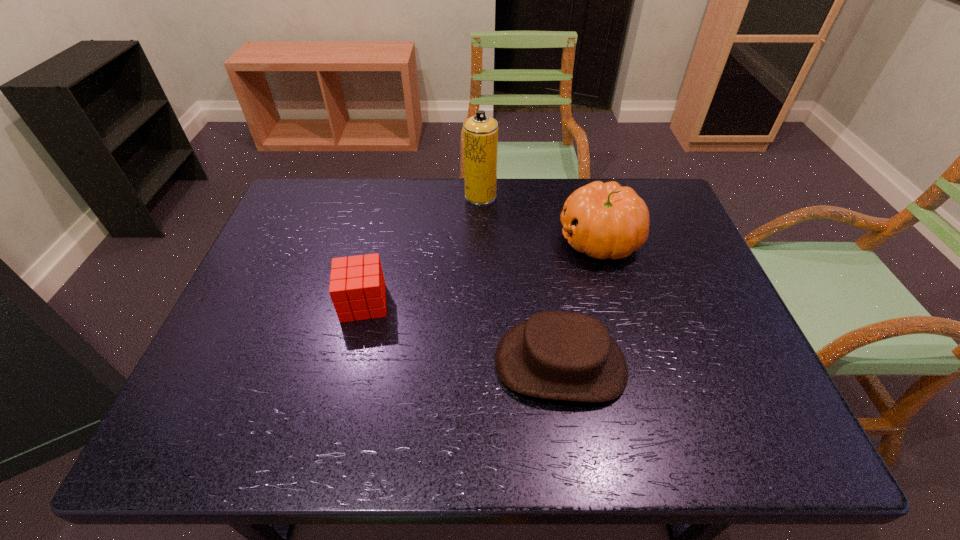
Where is `blank space at the far left corner of the desktop`? The width and height of the screenshot is (960, 540). blank space at the far left corner of the desktop is located at coordinates (326, 201).

Find the location of a particular element. vacant space at the near left corner of the desktop is located at coordinates (205, 413).

Where is `free region at the near right corner of the desktop`? This screenshot has height=540, width=960. free region at the near right corner of the desktop is located at coordinates click(708, 432).

At what (x,y) coordinates should I click in order to perform the action: click on free space between the tallest object and the third shortest object. Please return your answer as a coordinate pair (x, y). Looking at the image, I should click on (540, 218).

I want to click on vacant space in between the leftmost object and the nearest object, so 462,333.

Identify the location of unoccupied position between the second farthest object and the nearest object. The width and height of the screenshot is (960, 540). (580, 301).

The height and width of the screenshot is (540, 960). I want to click on free space that is in between the second tallest object and the farthest object, so click(540, 218).

This screenshot has height=540, width=960. I want to click on unoccupied position between the second nearest object and the tallest object, so click(422, 249).

Locate an element on the screen. free space between the nearest object and the farthest object is located at coordinates (520, 280).

You are a GUI agent. You are given a task and a screenshot of the screen. Output one action in this format:
    pyautogui.click(x=<x>, y=<y>)
    Task: Click on the vacant area between the cube and the hat
    
    Given the screenshot: What is the action you would take?
    pyautogui.click(x=462, y=333)